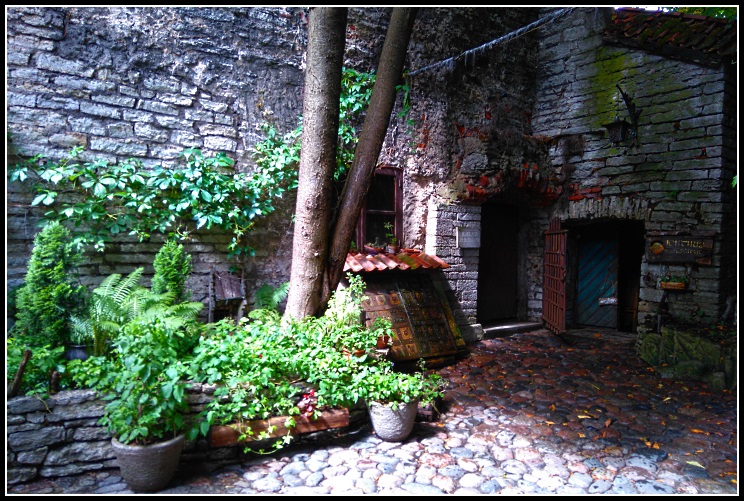
Where is `1 basement`? This screenshot has height=501, width=744. 1 basement is located at coordinates (426, 323).